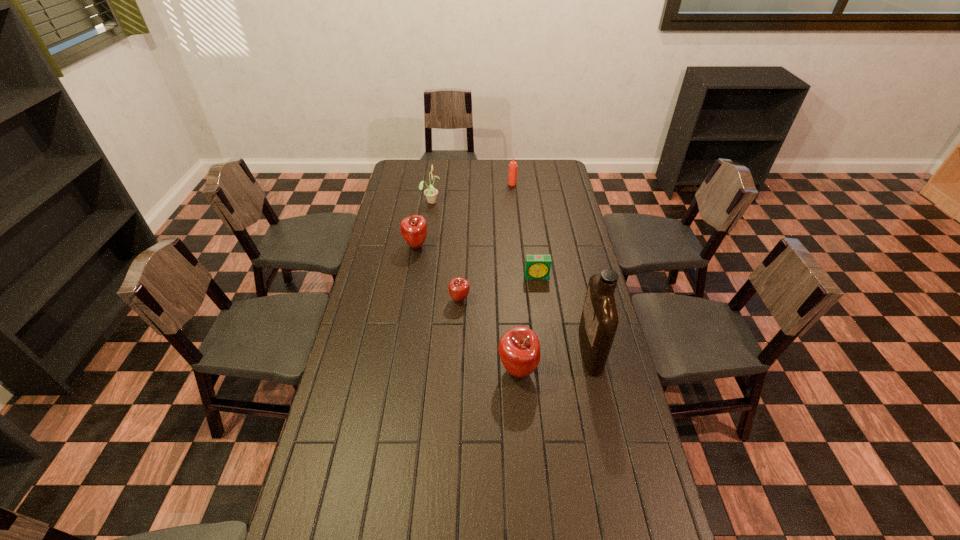
Identify the location of object situated at the left edge. The width and height of the screenshot is (960, 540). (413, 228).

Locate an element on the screen. The image size is (960, 540). object that is at the right edge is located at coordinates (599, 320).

At what (x,y) coordinates should I click in order to perform the action: click on blank space at the far edge of the desktop. Please return your answer as a coordinate pair (x, y). This screenshot has height=540, width=960. Looking at the image, I should click on (433, 168).

You are a GUI agent. You are given a task and a screenshot of the screen. Output one action in this format:
    pyautogui.click(x=<x>, y=<y>)
    Task: Click on the vacant space at the left edge of the desktop
    The width and height of the screenshot is (960, 540).
    Given the screenshot: What is the action you would take?
    pyautogui.click(x=411, y=202)

In order to click on free location at the right edge in this screenshot , I will do `click(606, 470)`.

Identify the location of vacant space at the far left corner of the desktop. The width and height of the screenshot is (960, 540). (405, 173).

Locate an element on the screen. The width and height of the screenshot is (960, 540). vacant space that's between the second farthest object and the alarm clock is located at coordinates (484, 239).

What are the coordinates of `free space between the rightmost apple and the sunflower` in the screenshot? It's located at (474, 286).

Where is `free space between the fourth farthest object and the leftmost apple`? free space between the fourth farthest object and the leftmost apple is located at coordinates click(476, 261).

This screenshot has width=960, height=540. I want to click on free space that is in between the rightmost apple and the tallest object, so click(x=554, y=360).